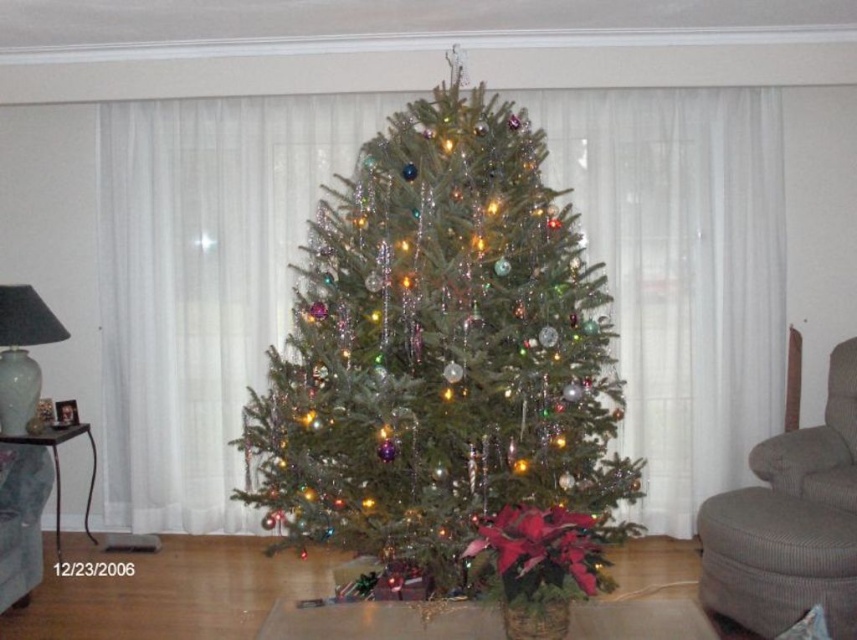
Can you confirm if green textured christmas tree at center is positioned above gray fabric armchair at right?

Correct, green textured christmas tree at center is located above gray fabric armchair at right.

Who is shorter, green textured christmas tree at center or gray fabric armchair at right?

gray fabric armchair at right is shorter.

Is point (309, 243) closer to viewer compared to point (835, 442)?

No, (309, 243) is behind (835, 442).

Image resolution: width=857 pixels, height=640 pixels. Identify the location of green textured christmas tree at center. (442, 355).

Which of these two, green textured christmas tree at center or red velvet poinsettia at lower center, stands shorter?

red velvet poinsettia at lower center is shorter.

Which is more to the left, green textured christmas tree at center or red velvet poinsettia at lower center?

green textured christmas tree at center

Is point (538, 269) more distant than point (524, 563)?

Yes, it is behind point (524, 563).

Find the location of `green textured christmas tree at center`. green textured christmas tree at center is located at coordinates (442, 355).

Between gray fabric armchair at right and gray fabric armchair at lower left, which one has more height?

gray fabric armchair at right is taller.

Consider the image. Is gray fabric armchair at right above gray fabric armchair at lower left?

Yes, gray fabric armchair at right is above gray fabric armchair at lower left.

The image size is (857, 640). In order to click on gray fabric armchair at right in this screenshot , I will do `click(790, 522)`.